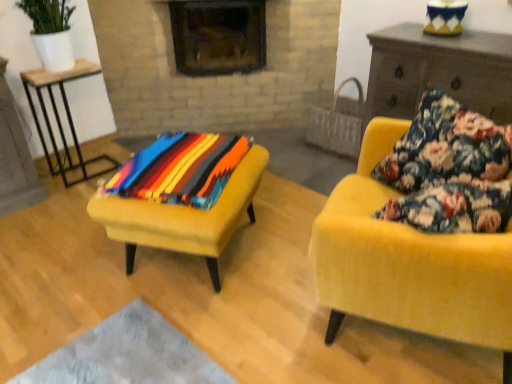
Question: Which is correct: velvet yellow armchair at right is inside velvet yellow stool at center, or outside of it?

Choices:
 (A) inside
 (B) outside

Answer: (B)

Question: In terms of width, does velvet yellow armchair at right look wider or thinner when compared to velvet yellow stool at center?

Choices:
 (A) thin
 (B) wide

Answer: (B)

Question: Considering the real-world distances, which object is farthest from the white ceramic pot at upper left?

Choices:
 (A) wooden table at left
 (B) multicolored woven blanket at center
 (C) floral fabric pillow at right
 (D) brick fireplace at upper center
 (E) wooden dresser at right

Answer: (C)

Question: Which of these objects is positioned farthest from the floral fabric pillow at right?

Choices:
 (A) woven straw picnic basket at center
 (B) wooden dresser at right
 (C) velvet yellow armchair at right
 (D) white ceramic pot at upper left
 (E) brick fireplace at upper center

Answer: (D)